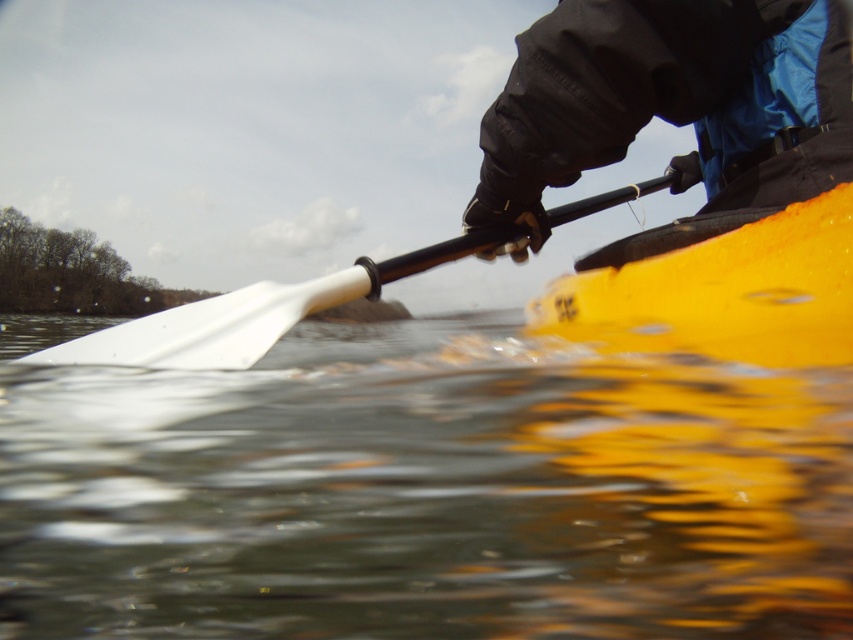
Is transparent water at lower center positioned at the back of yellow matte kayak at center?

Yes, it is behind yellow matte kayak at center.

Which is in front, point (761, 556) or point (750, 362)?

Point (750, 362) is more forward.

Is point (38, 374) closer to camera compared to point (842, 301)?

No, it is not.

The width and height of the screenshot is (853, 640). I want to click on transparent water at lower center, so click(x=426, y=492).

Can you confirm if transparent water at lower center is wider than white plastic paddle at center?

Yes.

Between transparent water at lower center and white plastic paddle at center, which one is positioned higher?

white plastic paddle at center is higher up.

Image resolution: width=853 pixels, height=640 pixels. I want to click on transparent water at lower center, so click(426, 492).

Where is `black waterproof jacket at upper right`? The width and height of the screenshot is (853, 640). black waterproof jacket at upper right is located at coordinates tap(671, 109).

Describe the element at coordinates (671, 109) in the screenshot. This screenshot has height=640, width=853. I see `black waterproof jacket at upper right` at that location.

Image resolution: width=853 pixels, height=640 pixels. I want to click on black waterproof jacket at upper right, so click(x=671, y=109).